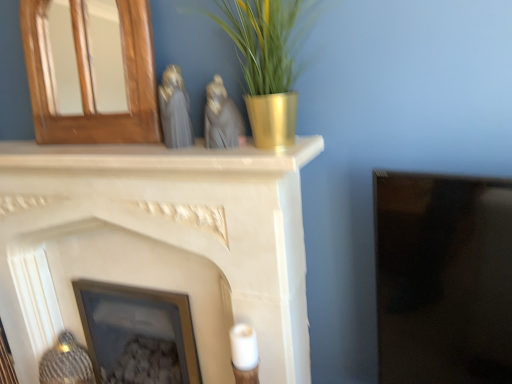
This screenshot has width=512, height=384. Find the location of `vacant space in front of matte gray statue at center, which is the 1th animal in right-to-left order`. vacant space in front of matte gray statue at center, which is the 1th animal in right-to-left order is located at coordinates (234, 147).